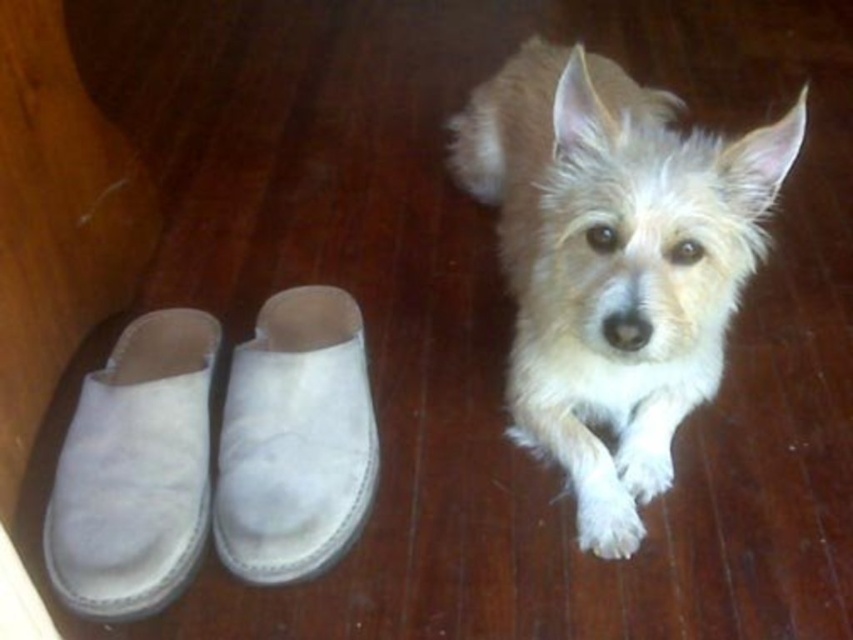
Between white fluffy dog at center and suede slipper at center, which one has less height?

With less height is suede slipper at center.

Between point (573, 296) and point (239, 547), which one is positioned behind?

Positioned behind is point (239, 547).

Which is in front, point (624, 429) or point (259, 321)?

Positioned in front is point (624, 429).

The width and height of the screenshot is (853, 640). Identify the location of white fluffy dog at center. (613, 262).

Is suede slipper at lower left to the right of suede slipper at center from the viewer's perspective?

In fact, suede slipper at lower left is to the left of suede slipper at center.

How far apart are suede slipper at lower left and suede slipper at center?

suede slipper at lower left is 5.32 inches from suede slipper at center.

Is point (97, 592) farther from viewer compared to point (373, 481)?

No, (97, 592) is closer to viewer.

What are the coordinates of `suede slipper at lower left` in the screenshot? It's located at (135, 470).

Does white fluffy dog at center come behind suede slipper at lower left?

No, white fluffy dog at center is closer to the viewer.

Is point (688, 220) positioned before point (120, 596)?

Yes, it is in front of point (120, 596).

Based on the photo, who is more forward, (492,141) or (190,339)?

Positioned in front is point (190,339).

I want to click on white fluffy dog at center, so click(x=613, y=262).